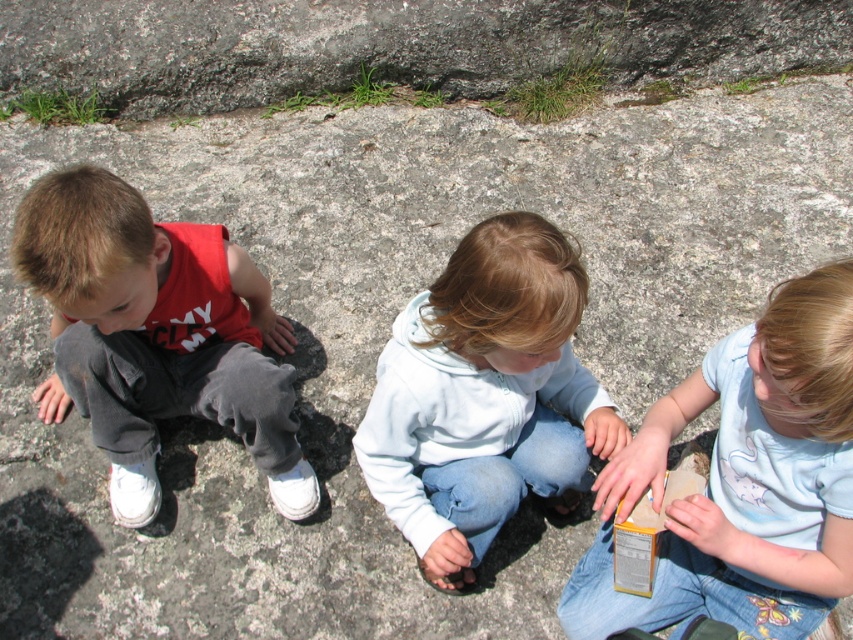
Question: Does matte gray pants at left appear on the right side of light blue fleece at center?

Choices:
 (A) no
 (B) yes

Answer: (A)

Question: Estimate the real-world distances between objects in this image. Which object is closer to the light blue cotton shirt at center?

Choices:
 (A) matte gray pants at left
 (B) gray rough stone at upper center

Answer: (A)

Question: Does light blue cotton shirt at center appear on the left side of light blue fleece at center?

Choices:
 (A) yes
 (B) no

Answer: (B)

Question: Based on their relative distances, which object is nearer to the gray rough stone at upper center?

Choices:
 (A) matte gray pants at left
 (B) light blue cotton shirt at center

Answer: (A)

Question: Considering the real-world distances, which object is farthest from the light blue fleece at center?

Choices:
 (A) gray rough stone at upper center
 (B) light blue cotton shirt at center

Answer: (A)

Question: Is gray rough stone at upper center smaller than matte gray pants at left?

Choices:
 (A) yes
 (B) no

Answer: (B)